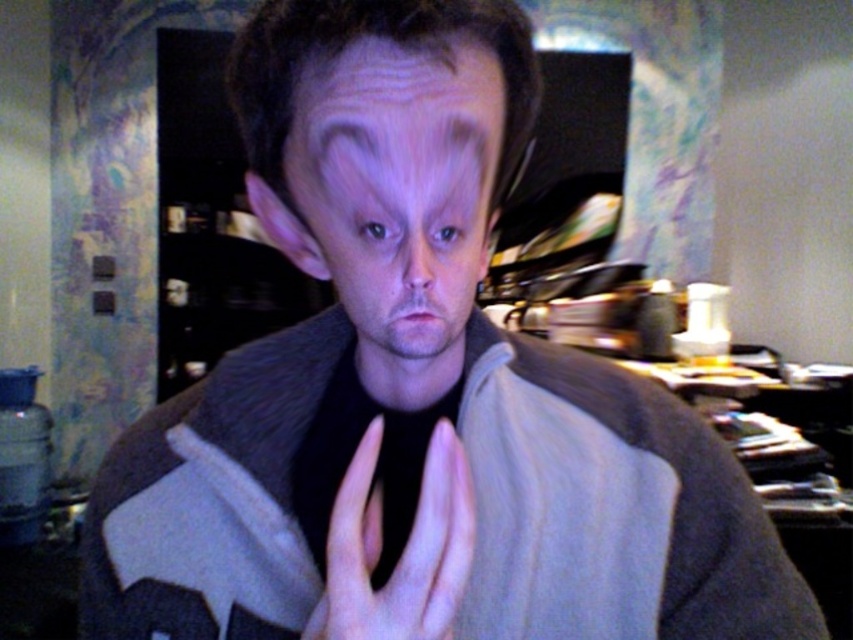
You are a photographer adjusting your camera settings to capture the person in the scene. The matte gray hair at center is represented by point (393, 188). Where should you focus your camera to ensure the matte gray hair at center is in sharp focus?

To ensure the matte gray hair at center is in sharp focus, you should focus your camera on the point (393, 188) where the matte gray hair at center is located.

You are a stylist preparing to take a portrait photo. You notice the matte gray hair at center and the skinny white hand at center in the frame. Which object should you adjust to ensure the subject looks more composed?

The matte gray hair at center is located above the skinny white hand at center. To ensure the subject looks more composed, you should adjust the matte gray hair at center so it does not overlap or distract from the position of the skinny white hand at center.

You are standing in a dimly lit indoor area that looks like a kitchen or dining area. You see two points marked in the scene. The first point is at coordinate (347, 104), and the second is at (456, 573). Which of these two points is closer to you?

Point (347, 104) is closer to you because it is further to the viewer than point (456, 573).